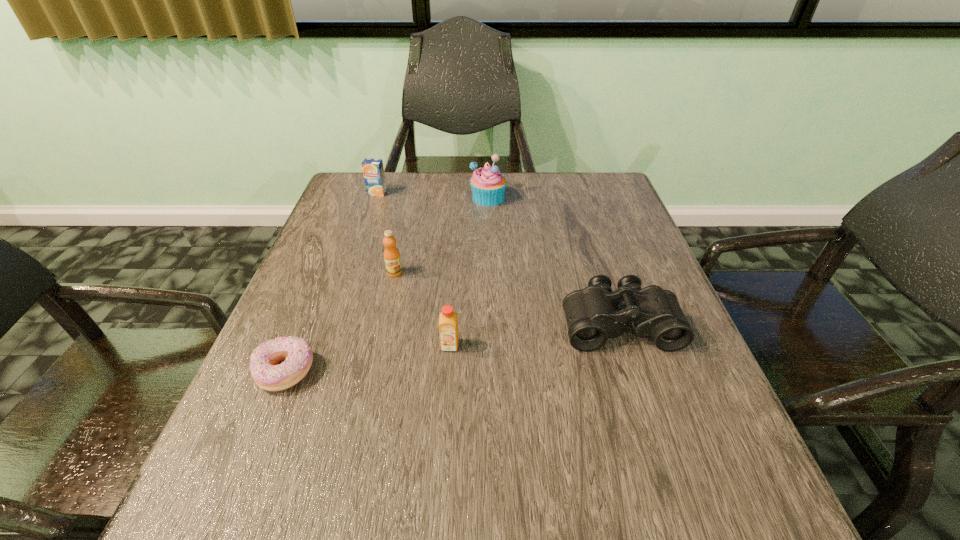
Identify the location of muffin. (488, 185).

In order to click on the third object from left to right in this screenshot , I will do `click(392, 259)`.

The height and width of the screenshot is (540, 960). What are the coordinates of `the second orange juice from left to right` in the screenshot? It's located at (392, 259).

The height and width of the screenshot is (540, 960). Identify the location of the farthest orange juice. (373, 171).

The image size is (960, 540). In order to click on the rightmost orange juice in this screenshot , I will do `click(448, 326)`.

Where is `the nearest orange juice`? the nearest orange juice is located at coordinates (448, 326).

Where is `binoculars`? The height and width of the screenshot is (540, 960). binoculars is located at coordinates (592, 315).

Find the location of a particular element. doughnut is located at coordinates (297, 353).

The height and width of the screenshot is (540, 960). I want to click on vacant space located on the back of the second object from right to left, so [488, 179].

Identify the location of free space located on the front label of the fourth object from right to left. (373, 364).